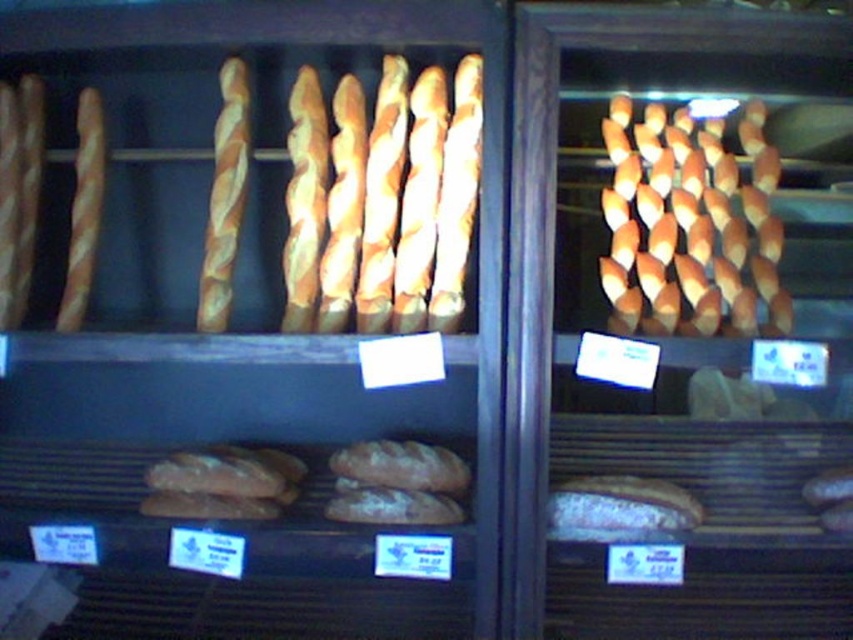
Based on the photo, you are a customer standing in front of the bakery display case. You want to pick up the golden brown twisted bread at center. Which bread should you look behind or in front of the golden brown baguette at center to find it?

The golden brown twisted bread at center is located behind the golden brown baguette at center since it is farther away from the viewer compared to the baguette.

You are a customer looking at the bakery display case. You see the golden brown baguette at center and the golden brown twisted bread at center. Which one is located to the right?

The golden brown baguette at center is positioned on the right side of the golden brown twisted bread at center, so the golden brown baguette at center is located to the right.

You are a customer looking at the bakery display case. You see the golden brown baguette at center and the golden brown twisted bread at center. Which one is placed higher in the display?

The golden brown twisted bread at center is placed higher than the golden brown baguette at center.